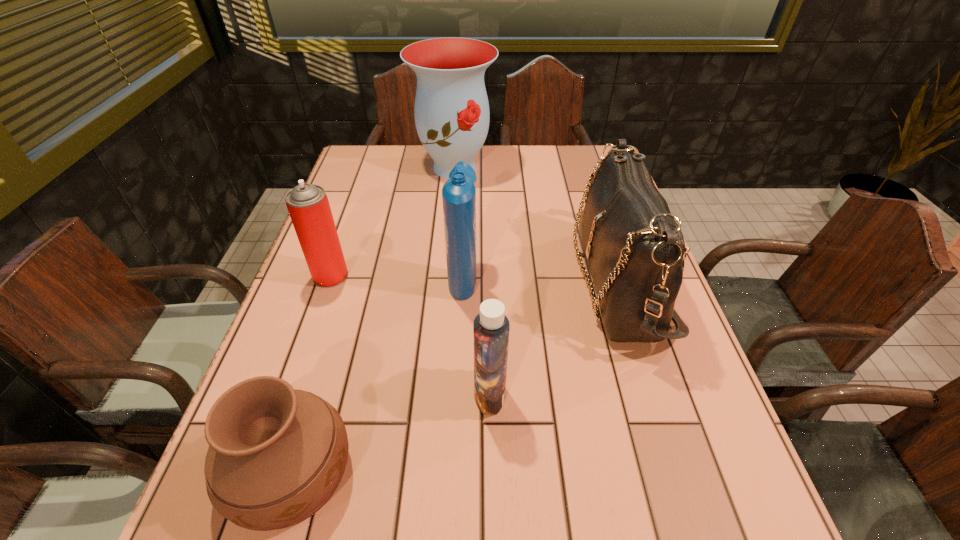
You are a GUI agent. You are given a task and a screenshot of the screen. Output one action in this format:
    pyautogui.click(x=<x>, y=<y>)
    Task: Click on the farthest object
    This screenshot has width=960, height=540.
    Given the screenshot: What is the action you would take?
    pyautogui.click(x=451, y=110)

You are a GUI agent. You are given a task and a screenshot of the screen. Output one action in this format:
    pyautogui.click(x=<x>, y=<y>)
    Task: Click on the taller shampoo
    This screenshot has height=540, width=960.
    Given the screenshot: What is the action you would take?
    pyautogui.click(x=458, y=193)

What are the coordinates of `handbag` in the screenshot? It's located at (634, 247).

Identify the location of aerosol can. Image resolution: width=960 pixels, height=540 pixels. (308, 206).

Identify the location of the nearer shampoo. The width and height of the screenshot is (960, 540). (491, 327).

Identify the location of free space located on the right of the vase. (587, 167).

Find the location of a particular element. free spot located 0.090m on the front of the farther shampoo is located at coordinates (461, 332).

What are the coordinates of `free space located 0.360m at the front of the rightmost object with chain and zipper` in the screenshot? It's located at (427, 282).

The width and height of the screenshot is (960, 540). Identify the location of blank space located 0.060m at the front of the rightmost object with chain and zipper. (551, 282).

What are the coordinates of `vacant position located at the front of the rightmost object with chain and zipper` in the screenshot? It's located at (556, 282).